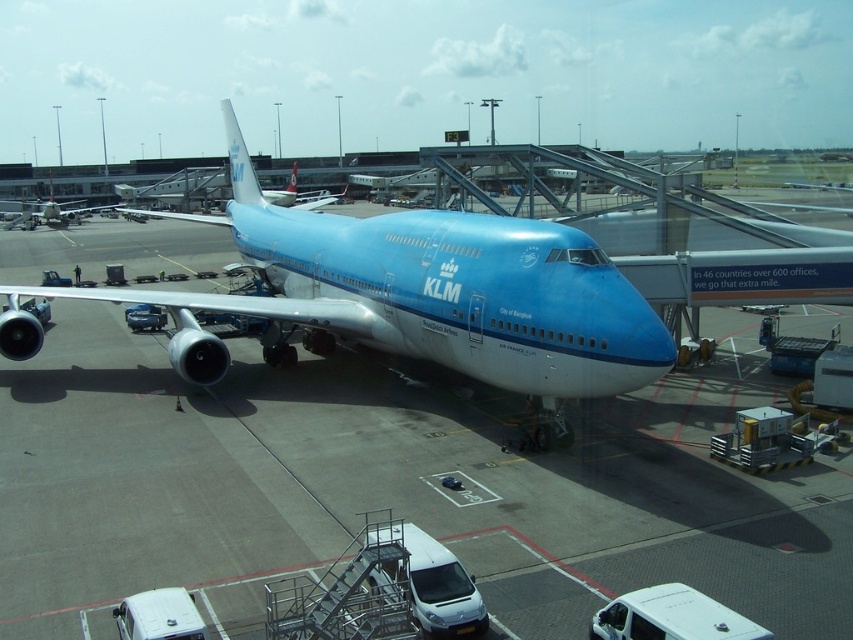
Question: Which point is closer to the camera?

Choices:
 (A) (521, 228)
 (B) (125, 374)

Answer: (A)

Question: Can you confirm if blue glossy airplane at center is positioned to the right of matte blue airplane at center?

Choices:
 (A) yes
 (B) no

Answer: (A)

Question: In this image, where is blue glossy airplane at center located relative to matte blue airplane at center?

Choices:
 (A) above
 (B) below

Answer: (B)

Question: Which object is closer to the camera taking this photo?

Choices:
 (A) matte blue airplane at center
 (B) blue glossy airplane at center

Answer: (B)

Question: Which object is closer to the camera taking this photo?

Choices:
 (A) blue glossy airplane at center
 (B) matte blue airplane at center

Answer: (A)

Question: Is blue glossy airplane at center wider than matte blue airplane at center?

Choices:
 (A) yes
 (B) no

Answer: (A)